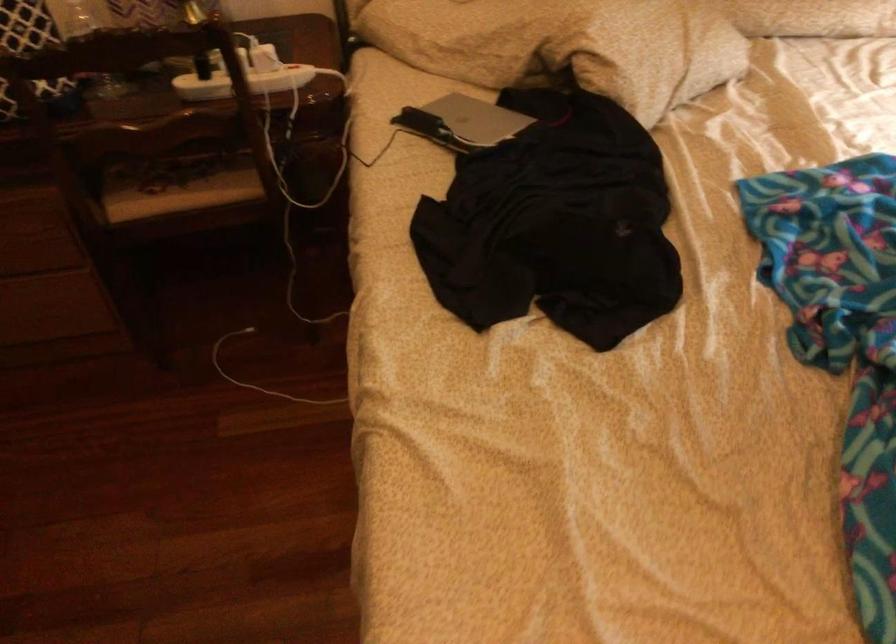
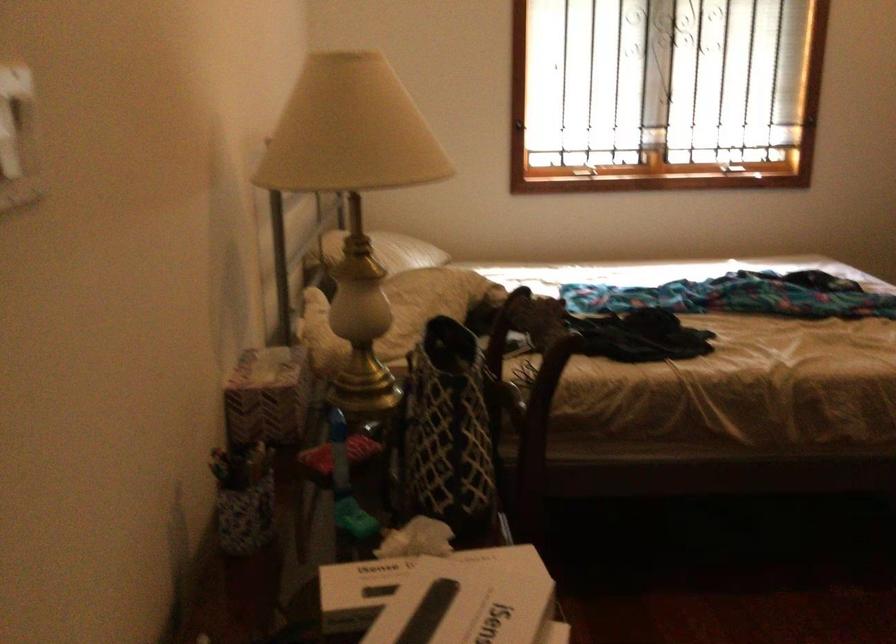
Question: I am providing you with two images of the same scene from different viewpoints. Please identify which objects are invisible in image2.

Choices:
 (A) white pillow
 (B) silver laptop
 (C) brown carrying case
 (D) window latch

Answer: (B)